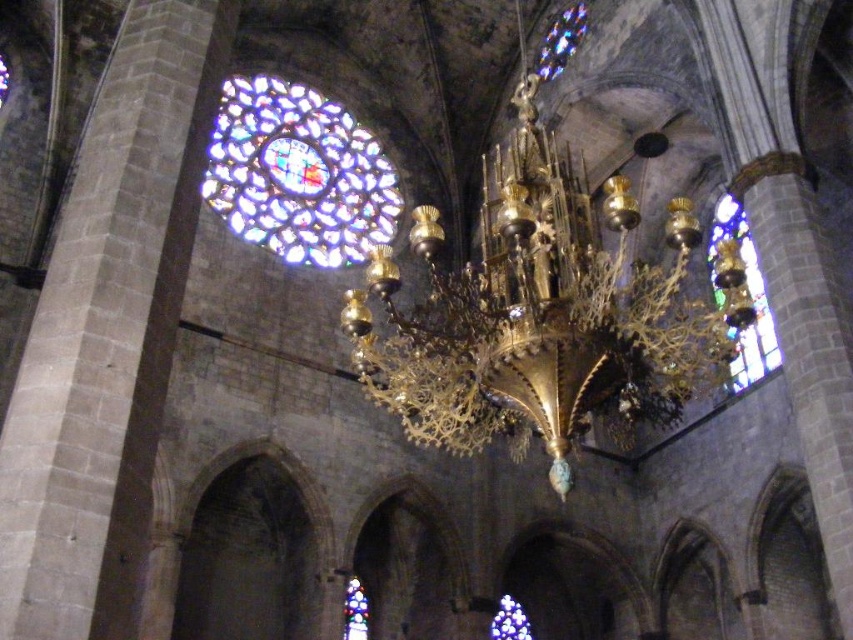
Is stained glass at upper center to the left of stained glass window at center from the viewer's perspective?

Indeed, stained glass at upper center is positioned on the left side of stained glass window at center.

Does point (366, 193) lie behind point (363, 614)?

Yes, it is.

Which is in front, point (343, 198) or point (347, 604)?

Positioned in front is point (347, 604).

I want to click on stained glass at upper center, so click(x=299, y=173).

In the scene shown: Can you confirm if gold metallic chandelier at center is positioned to the left of stained glass window at center?

Incorrect, gold metallic chandelier at center is not on the left side of stained glass window at center.

Between gold metallic chandelier at center and stained glass window at center, which one has less height?

With less height is stained glass window at center.

Measure the distance between gold metallic chandelier at center and camera.

gold metallic chandelier at center and camera are 160.23 feet apart.

Image resolution: width=853 pixels, height=640 pixels. Identify the location of gold metallic chandelier at center. (544, 310).

From the picture: Who is lower down, gold metallic chandelier at center or stained glass window at right?

stained glass window at right is below.

Does point (434, 353) come closer to viewer compared to point (732, 237)?

Yes, it is in front of point (732, 237).

Does point (531, 134) come behind point (779, 362)?

That is False.

Where is `gold metallic chandelier at center`? Image resolution: width=853 pixels, height=640 pixels. gold metallic chandelier at center is located at coordinates (544, 310).